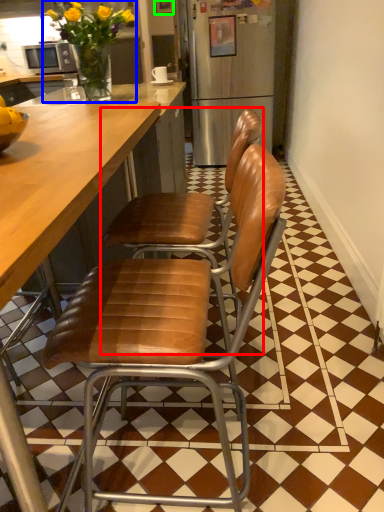
Question: Which object is the closest to the chair (highlighted by a red box)? Choose among these: houseplant (highlighted by a blue box) or picture frame (highlighted by a green box).

Choices:
 (A) houseplant
 (B) picture frame

Answer: (A)